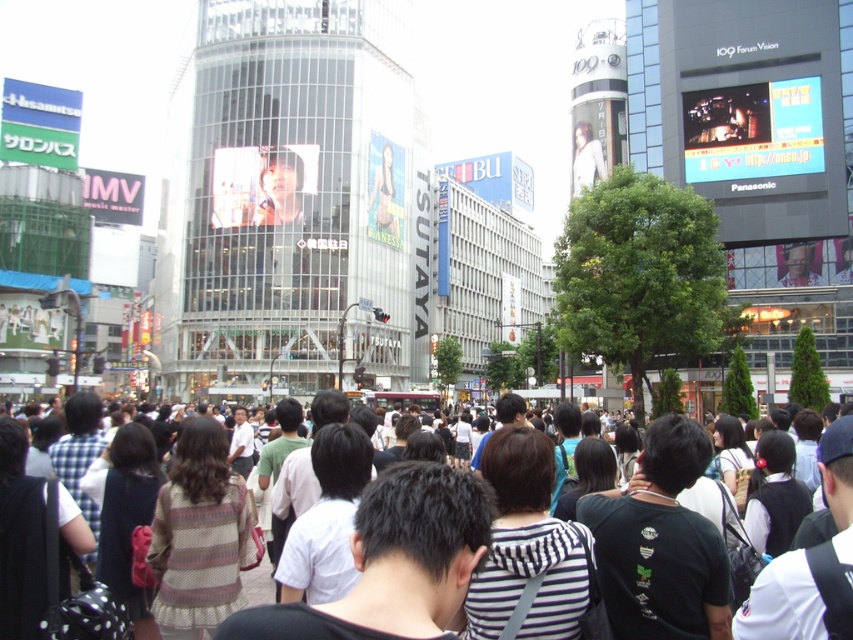
In the bustling urban scene described, there is a point marked at coordinates (280, 188). What object is located at this specific coordinate?

The point at coordinates (280, 188) is occupied by a smooth skin face at center.

You are a photographer trying to capture a clear shot of the smooth skin face at center and the white cotton shirt at center in the crowd. Which object should you zoom in on to ensure both are visible without cropping? Please explain your reasoning based on their sizes.

The smooth skin face at center has a lesser width compared to the white cotton shirt at center. Therefore, to ensure both are visible without cropping, you should zoom in on the white cotton shirt at center since it is wider and can accommodate the smaller face within the frame.

What are the coordinates of the smooth skin face at center in the image?

The smooth skin face at center is located at coordinates point (280, 188).